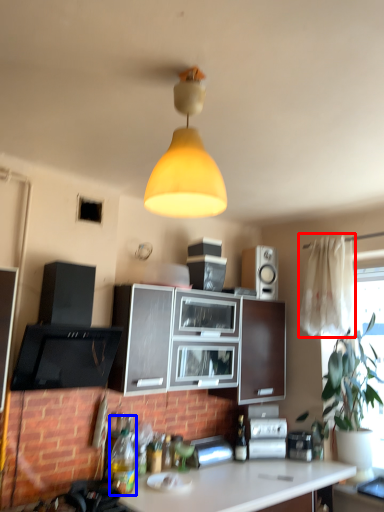
Question: Which object appears farthest to the camera in this image, curtain (highlighted by a red box) or bottle (highlighted by a blue box)?

Choices:
 (A) curtain
 (B) bottle

Answer: (A)